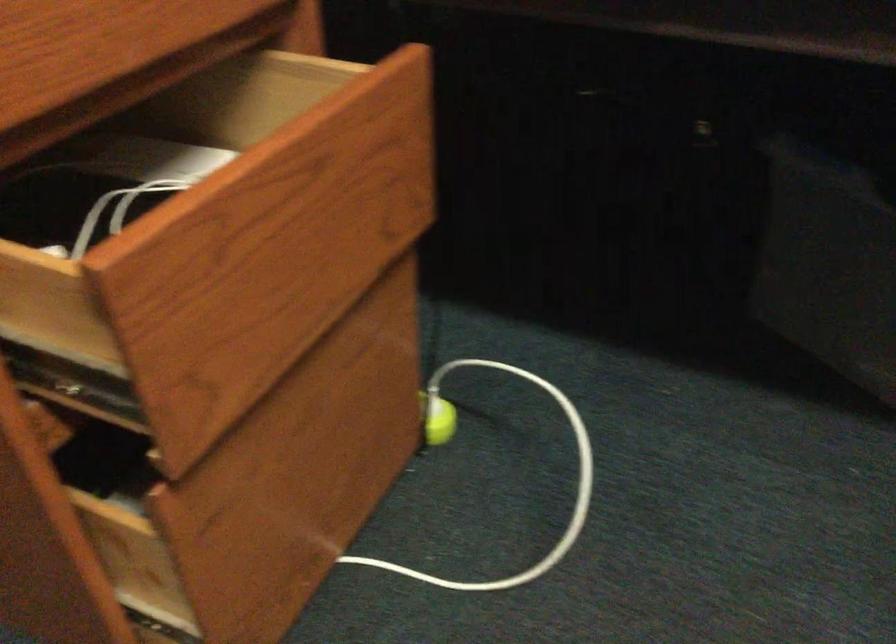
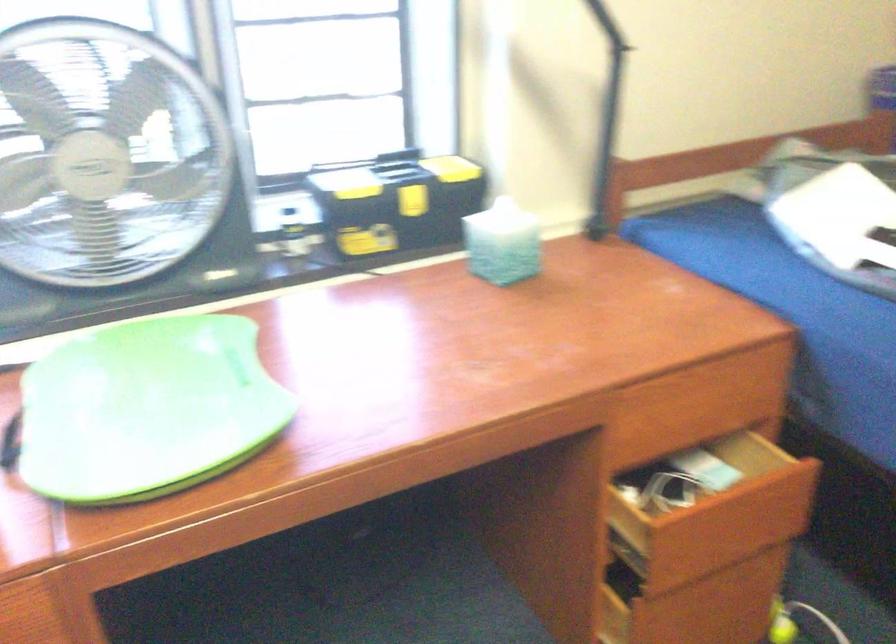
In the second image, find the point that corresponds to pixel 295 243 in the first image.

(721, 526)